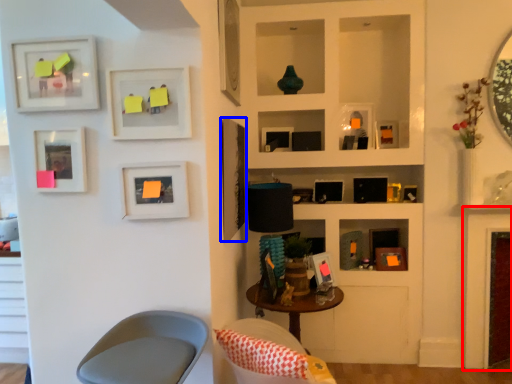
Question: Which of the following is the closest to the observer, fireplace (highlighted by a red box) or picture frame (highlighted by a blue box)?

Choices:
 (A) fireplace
 (B) picture frame

Answer: (B)